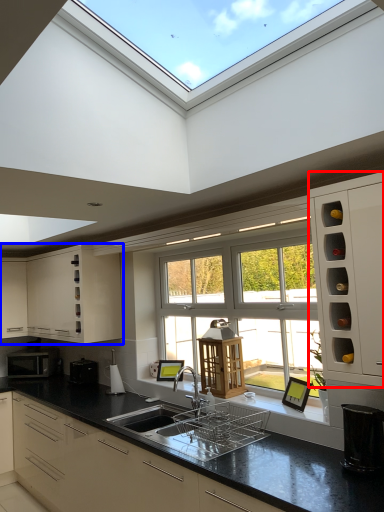
Question: Among these objects, which one is farthest to the camera, cabinetry (highlighted by a red box) or cabinetry (highlighted by a blue box)?

Choices:
 (A) cabinetry
 (B) cabinetry

Answer: (B)